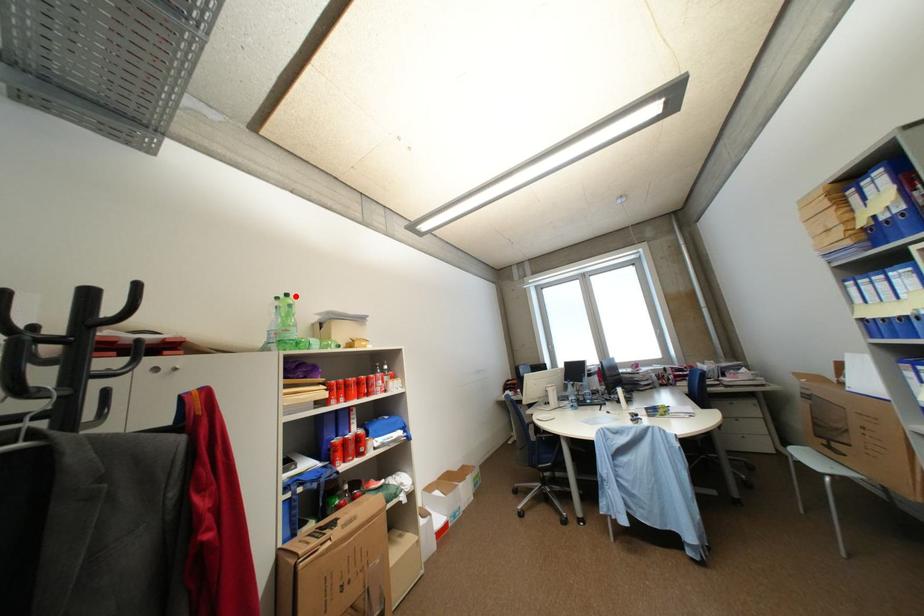
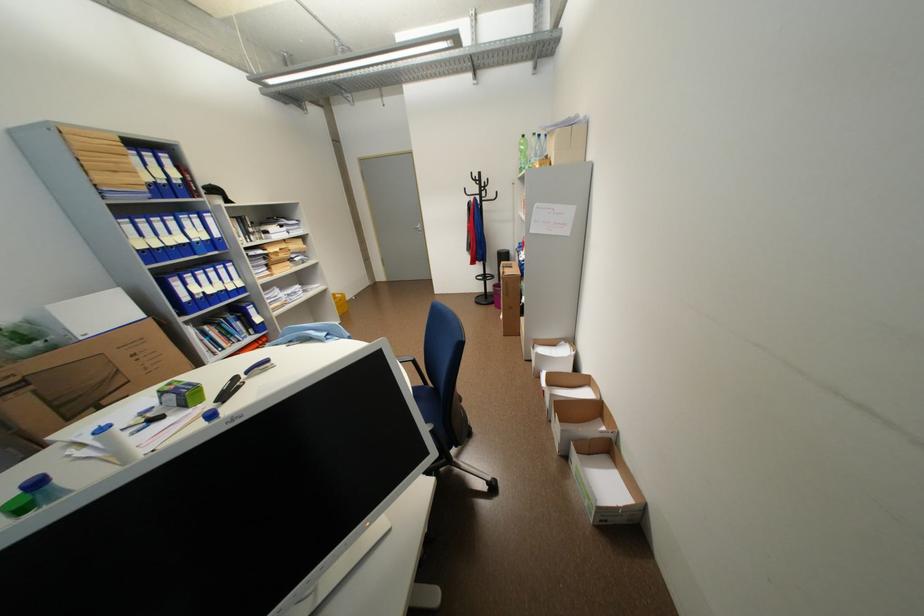
Locate, in the second image, the point that corresponds to the highlighted location in the first image.

(531, 137)